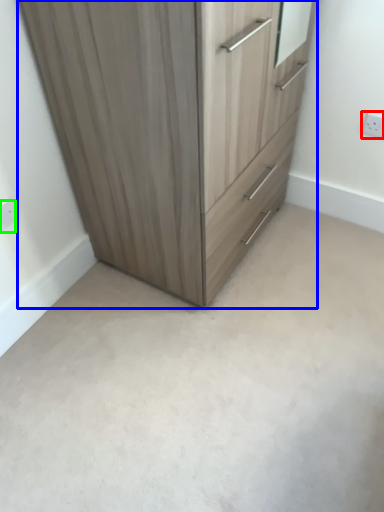
Question: Estimate the real-world distances between objects in this image. Which object is farther from electric outlet (highlighted by a red box), chest of drawers (highlighted by a blue box) or electric outlet (highlighted by a green box)?

Choices:
 (A) chest of drawers
 (B) electric outlet

Answer: (B)